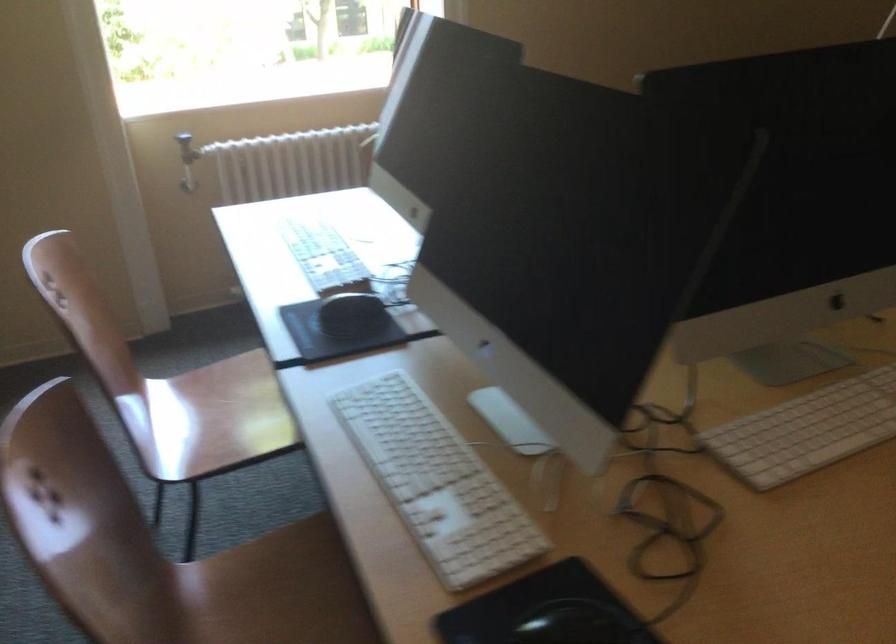
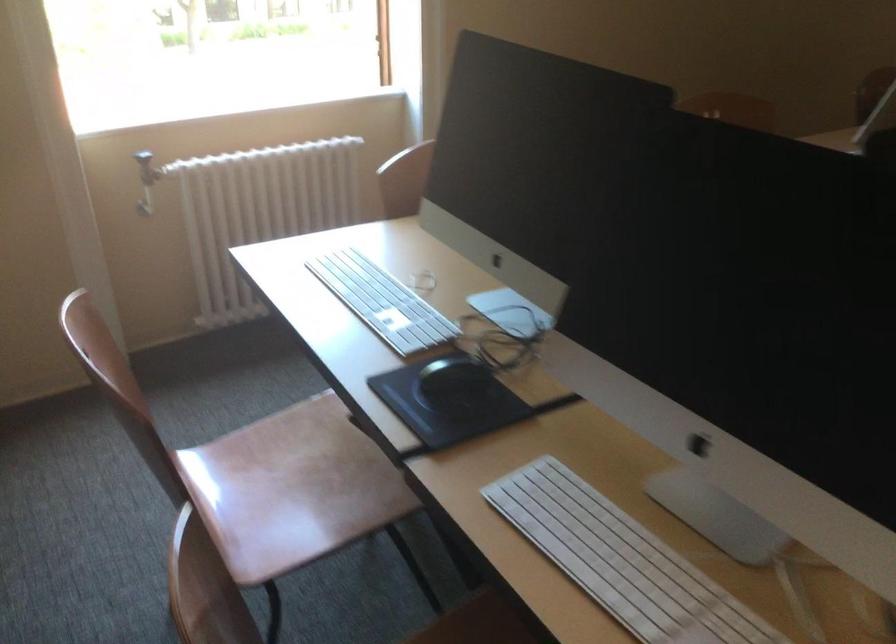
The point at (179,146) is marked in the first image. Where is the corresponding point in the second image?

(147, 167)